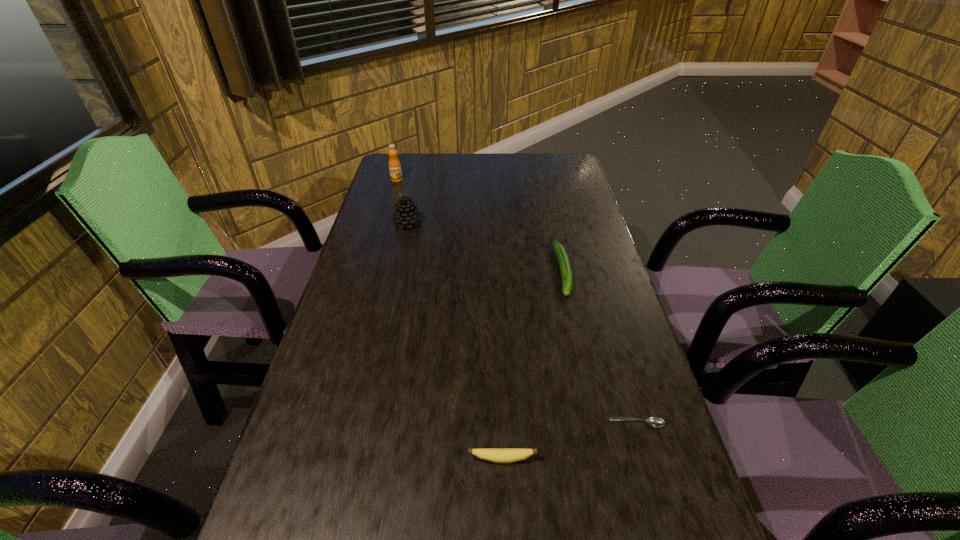
The height and width of the screenshot is (540, 960). What are the coordinates of `vacant space that satisfies the following two spatial constraints: 1. on the front label of the rightmost object; 2. on the right side of the leftmost object` in the screenshot? It's located at (325, 423).

Identify the location of blank space that satisfies the following two spatial constraints: 1. at the narrow end of the second nearest object; 2. on the left side of the pinecone. (364, 423).

Identify the location of free space that satisfies the following two spatial constraints: 1. on the back side of the third object from right to left; 2. on the left side of the shortest object. [500, 423].

Identify the location of free spot that satisfies the following two spatial constraints: 1. on the front label of the shortest object; 2. on the left side of the leftmost object. (325, 423).

Identify the location of vacant area in the image that satisfies the following two spatial constraints: 1. on the back side of the rightmost object; 2. at the narrow end of the fourth shortest object. (578, 223).

You are a GUI agent. You are given a task and a screenshot of the screen. Output one action in this format:
    pyautogui.click(x=<x>, y=<y>)
    Task: Click on the free space in the image that satisfies the following two spatial constraints: 1. at the narrow end of the banana; 2. on the right side of the fourth shortest object
    The height and width of the screenshot is (540, 960).
    Given the screenshot: What is the action you would take?
    point(356,459)